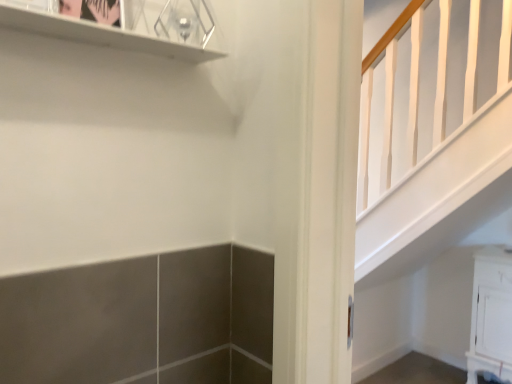
Question: Should I look upward or downward to see white glossy shelf at upper left?

Choices:
 (A) down
 (B) up

Answer: (B)